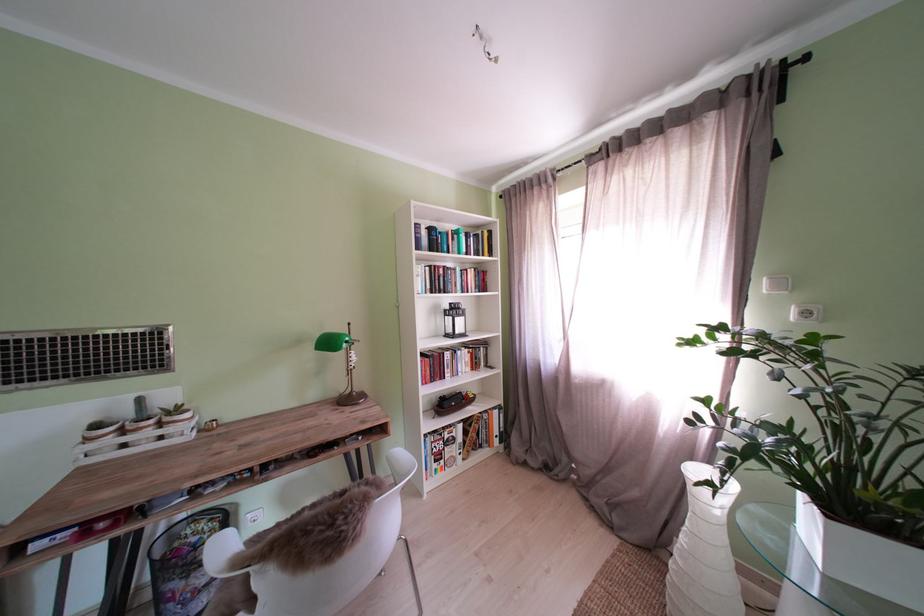
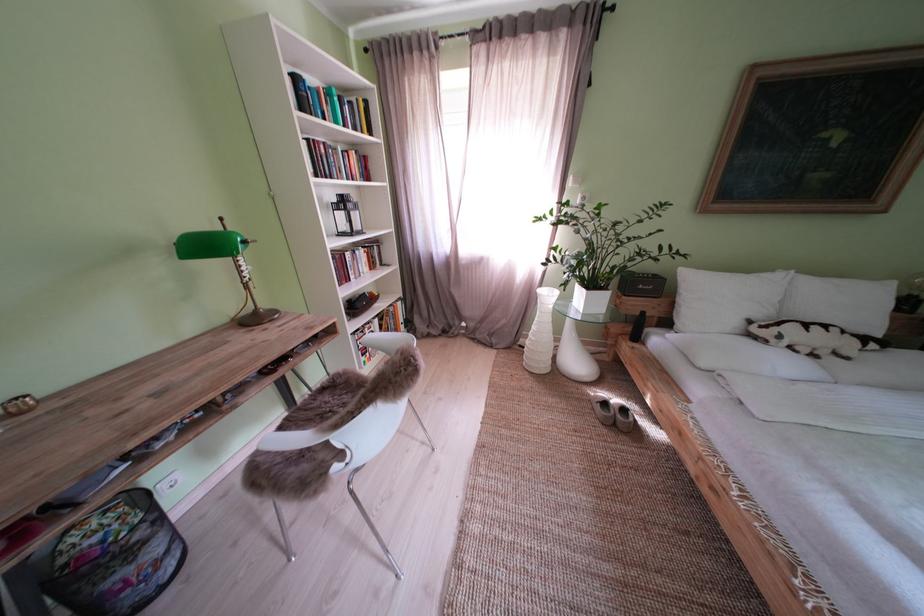
First-person continuous shooting, in which direction is the camera rotating?

The rotation direction of the camera is right-down.